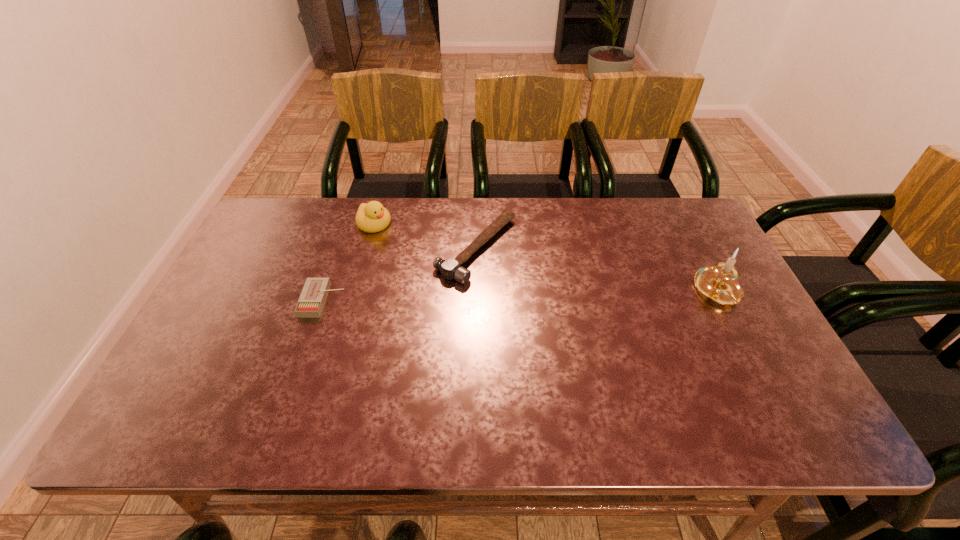
At what (x,y) coordinates should I click in order to perform the action: click on vacant space at the near right corner of the desktop. Please return your answer as a coordinate pair (x, y). Looking at the image, I should click on (732, 381).

Locate an element on the screen. The height and width of the screenshot is (540, 960). vacant area between the tallest object and the hammer is located at coordinates (597, 270).

This screenshot has width=960, height=540. I want to click on vacant area that lies between the duckling and the second object from right to left, so click(x=425, y=236).

Where is `vacant area that lies between the duckling and the hammer`? This screenshot has height=540, width=960. vacant area that lies between the duckling and the hammer is located at coordinates (425, 236).

Identify the location of vacant space in between the shortest object and the rightmost object. (520, 296).

Where is `unoccupied area between the matchbox and the rightmost object`? The image size is (960, 540). unoccupied area between the matchbox and the rightmost object is located at coordinates (520, 296).

I want to click on free space between the duckling and the matchbox, so click(x=348, y=262).

Where is `empty location between the shortest object and the candle holder`? The height and width of the screenshot is (540, 960). empty location between the shortest object and the candle holder is located at coordinates (520, 296).

The width and height of the screenshot is (960, 540). In order to click on vacant region between the shortest object and the candle holder in this screenshot , I will do `click(520, 296)`.

In order to click on free space between the duckling and the shortest object in this screenshot , I will do `click(348, 262)`.